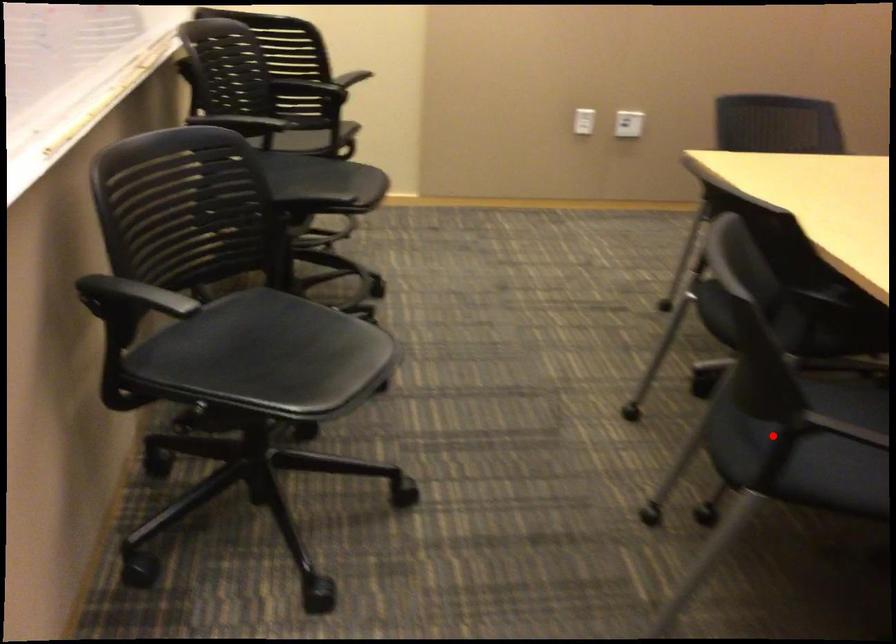
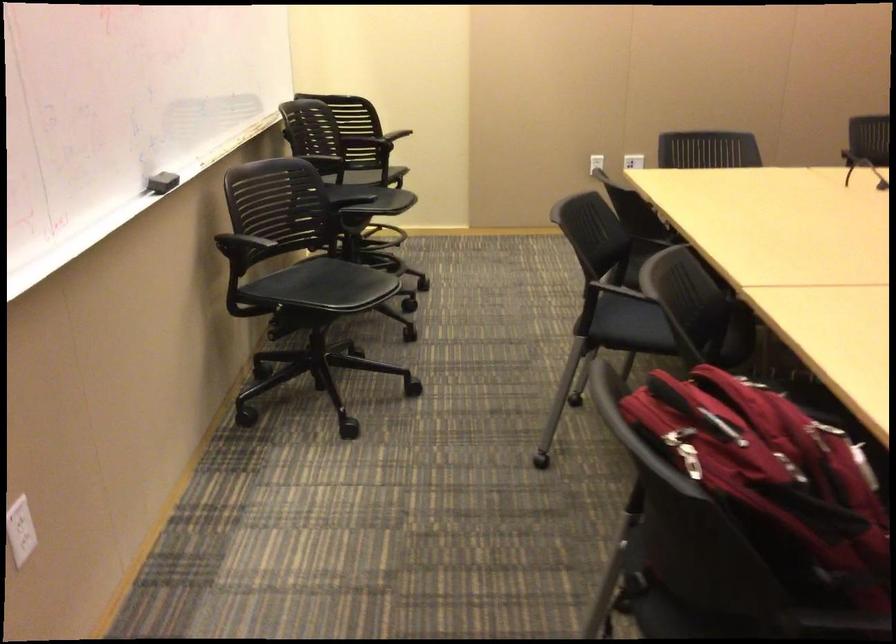
Where in the second image is the point corresponding to the highlighted location from the first image?

(629, 324)